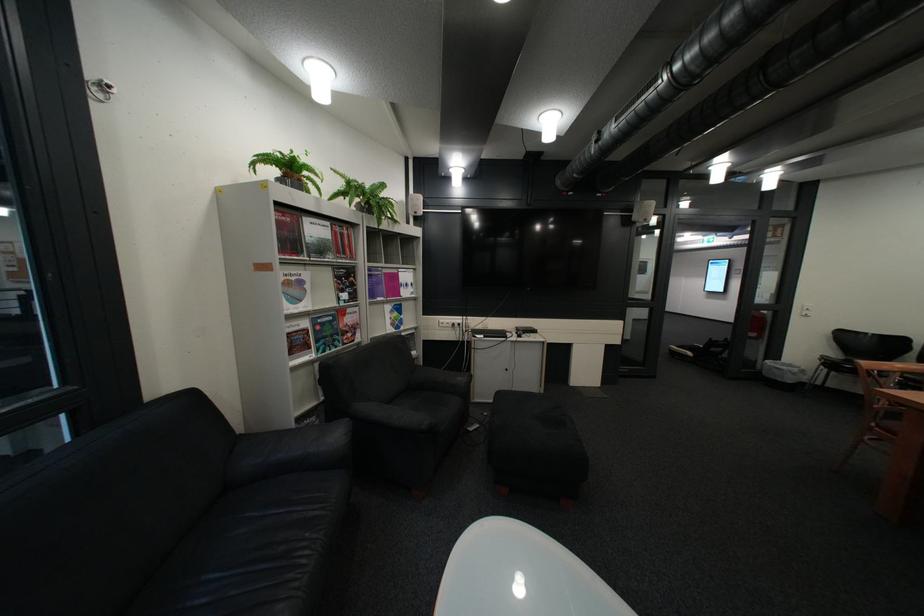
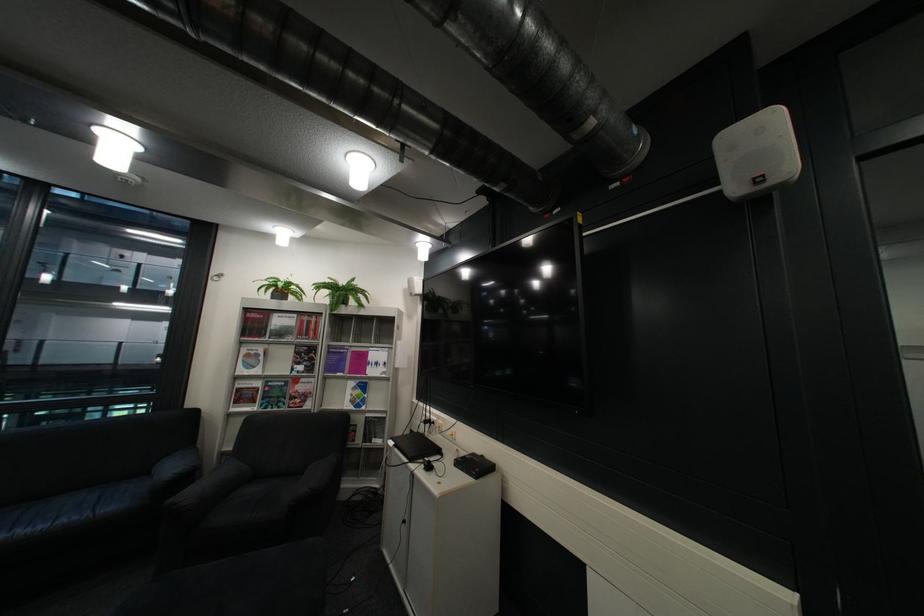
The point at (353, 277) is marked in the first image. Where is the corresponding point in the second image?

(311, 353)